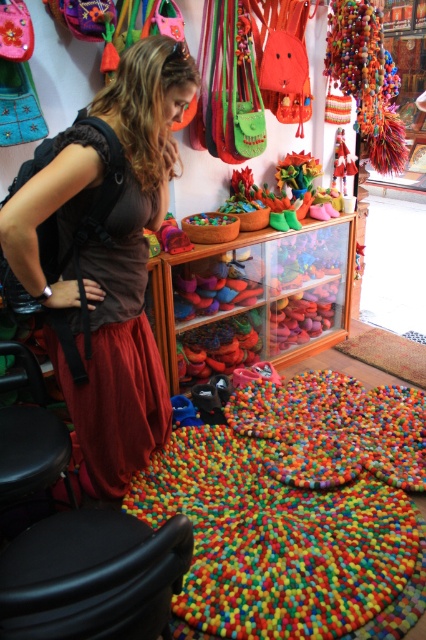
You are a customer in the shop and want to know if the brown fabric skirt at center is taller than the black plastic stool at lower left. Can you confirm?

The brown fabric skirt at center has a greater height compared to the black plastic stool at lower left, so yes, the brown fabric skirt at center is taller than the black plastic stool at lower left.

You are a customer in the shop and want to sit down. You see the brown fabric skirt at center and the black plastic stool at lower left. Which object is closer to you?

The black plastic stool at lower left is behind the brown fabric skirt at center, so the brown fabric skirt at center is closer to you.

You are a delivery person who needs to place a small package on the point marked at coordinates point (48, 589) in this shop. The package is 12 inches long. Can you safely place it there without it falling off?

The point marked at coordinates point (48, 589) is 33.02 inches away from the camera, so yes, the package can be safely placed there as it is far enough to accommodate the 12 inch length without falling off.